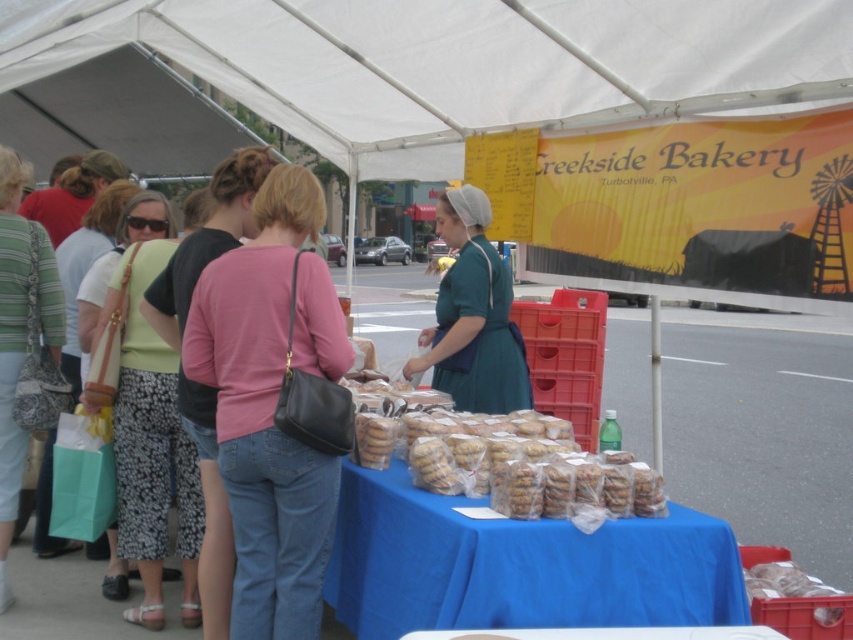
You are a customer at the Creekside Bakery Turbotville, PA market stall. You see the white fabric canopy at upper center and the translucent plastic cookies at center. Which object is above the other?

The white fabric canopy at upper center is positioned over translucent plastic cookies at center, so the white fabric canopy at upper center is above the translucent plastic cookies at center.

Based on the photo, you are a customer at the market and want to buy the translucent plastic cookies at center. You need to know if they are under the white fabric canopy at upper center. Can you confirm?

The white fabric canopy at upper center is bigger than translucent plastic cookies at center, so yes, the translucent plastic cookies at center are likely under the white fabric canopy at upper center.